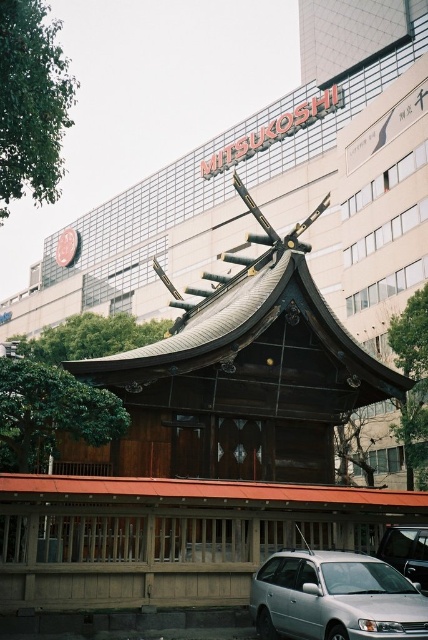
Question: Does silver metallic car at lower center have a lesser width compared to metallic silver car at center?

Choices:
 (A) yes
 (B) no

Answer: (B)

Question: Can you confirm if silver metallic car at lower center is thinner than metallic silver car at center?

Choices:
 (A) no
 (B) yes

Answer: (A)

Question: Which point appears closest to the camera in this image?

Choices:
 (A) tap(394, 525)
 (B) tap(294, 628)

Answer: (B)

Question: Which point appears farthest from the camera in this image?

Choices:
 (A) (308, 563)
 (B) (415, 580)

Answer: (B)

Question: Is silver metallic car at lower center above metallic silver car at center?

Choices:
 (A) no
 (B) yes

Answer: (A)